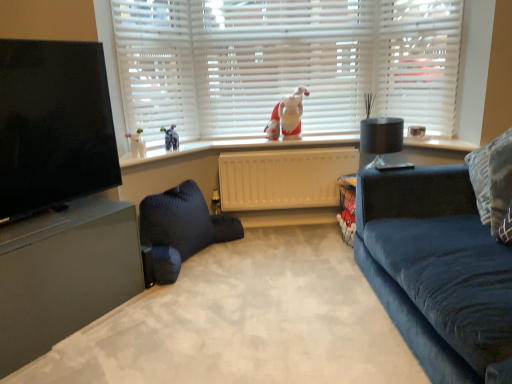
Identify the location of vacant space underneath fuzzy fabric gnome at center (from a real-world perspective). The image size is (512, 384). (282, 138).